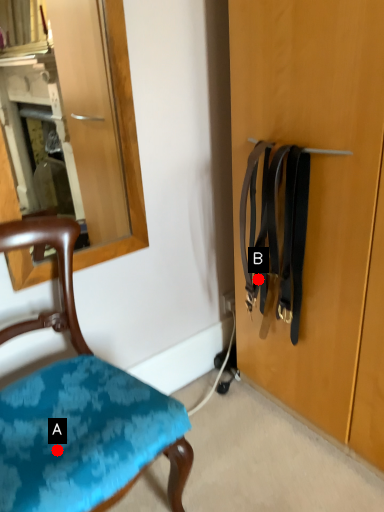
Question: Two points are circled on the image, labeled by A and B beside each circle. Which of the following is the farthest from the observer?

Choices:
 (A) A is further
 (B) B is further

Answer: (B)